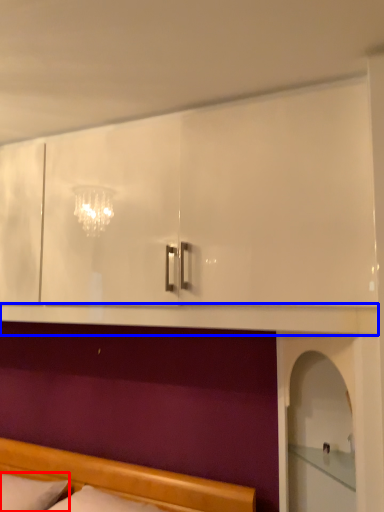
Question: Which point is closer to the camera, pillow (highlighted by a red box) or mantle (highlighted by a blue box)?

Choices:
 (A) pillow
 (B) mantle

Answer: (B)